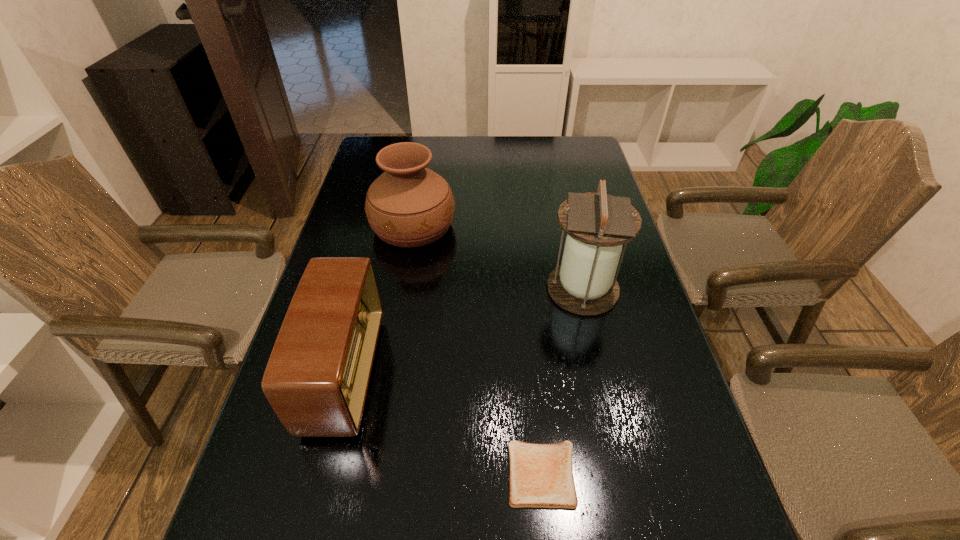
Where is `radio receiver at the left edge`? radio receiver at the left edge is located at coordinates (316, 380).

At what (x,y) coordinates should I click in order to perform the action: click on object present at the right edge. Please return your answer as a coordinate pair (x, y). Looking at the image, I should click on (597, 224).

The image size is (960, 540). In order to click on free region at the far edge of the desktop in this screenshot , I will do `click(508, 146)`.

Find the location of a particular element. free spot at the left edge of the desktop is located at coordinates (358, 196).

The height and width of the screenshot is (540, 960). In the image, there is a desktop. Identify the location of free space at the far left corner. (382, 136).

At what (x,y) coordinates should I click in order to perform the action: click on free space at the far right corner of the desktop. Please return your answer as a coordinate pair (x, y). Looking at the image, I should click on (554, 151).

Identify the location of empty space between the shortest object and the radio receiver. (444, 424).

Locate an element on the screen. This screenshot has height=540, width=960. free spot between the radio receiver and the toast is located at coordinates (444, 424).

Identify the location of vacant space in between the tallest object and the toast. Image resolution: width=960 pixels, height=540 pixels. (563, 381).

Locate an element on the screen. vacant area between the radio receiver and the tallest object is located at coordinates (464, 331).